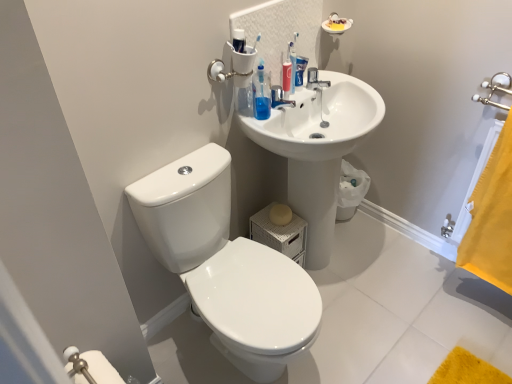
Where is `free region under yellow fabric towel at right (from a real-world perspective)`? The height and width of the screenshot is (384, 512). free region under yellow fabric towel at right (from a real-world perspective) is located at coordinates (470, 292).